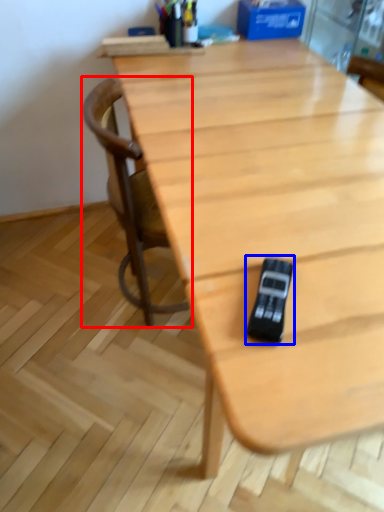
Question: Among these objects, which one is nearest to the camera, chair (highlighted by a red box) or game controller (highlighted by a blue box)?

Choices:
 (A) chair
 (B) game controller

Answer: (B)